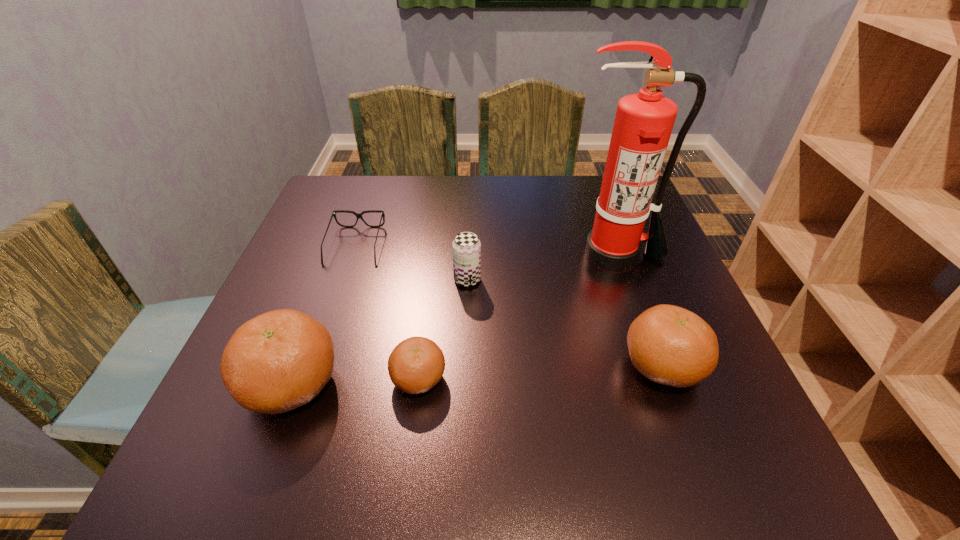
This screenshot has width=960, height=540. I want to click on the leftmost clementine, so click(x=280, y=360).

Where is `the second clementine from right to left`? This screenshot has width=960, height=540. the second clementine from right to left is located at coordinates (417, 364).

Find the location of a particular element. the fourth object from right to left is located at coordinates (417, 364).

Locate an element on the screen. the rightmost clementine is located at coordinates (669, 345).

Locate an element on the screen. spectacles is located at coordinates (359, 215).

You are a GUI agent. You are given a task and a screenshot of the screen. Output one action in this format:
    pyautogui.click(x=<x>, y=<y>)
    Task: Click on the fire extinguisher
    
    Given the screenshot: What is the action you would take?
    pyautogui.click(x=643, y=124)

Where is `the third object from right to left`? This screenshot has height=540, width=960. the third object from right to left is located at coordinates (466, 247).

Where is `free space located 0.370m on the right of the leftmost clementine`? This screenshot has height=540, width=960. free space located 0.370m on the right of the leftmost clementine is located at coordinates (549, 384).

Image resolution: width=960 pixels, height=540 pixels. Find the location of `blank space located 0.170m on the back of the fifth tallest object`. blank space located 0.170m on the back of the fifth tallest object is located at coordinates point(429,293).

Find the location of a particular element. This screenshot has width=960, height=540. vacant space located on the back of the second tallest clementine is located at coordinates (620, 253).